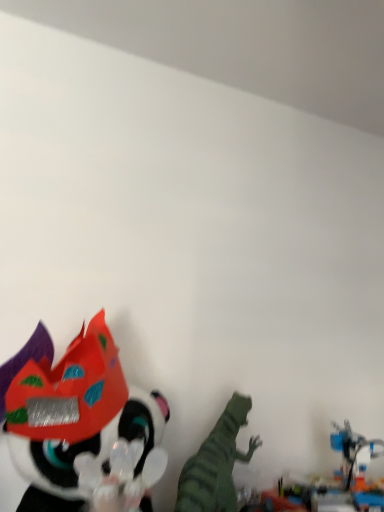
At what (x,y) coordinates should I click in order to perform the action: click on shiny plastic mask at lower left. Please return your answer as a coordinate pair (x, y). Image resolution: width=384 pixels, height=512 pixels. Looking at the image, I should click on (81, 426).

What do you see at coordinates (81, 426) in the screenshot?
I see `shiny plastic mask at lower left` at bounding box center [81, 426].

Find the location of `shiny plastic mask at lower left`. shiny plastic mask at lower left is located at coordinates (81, 426).